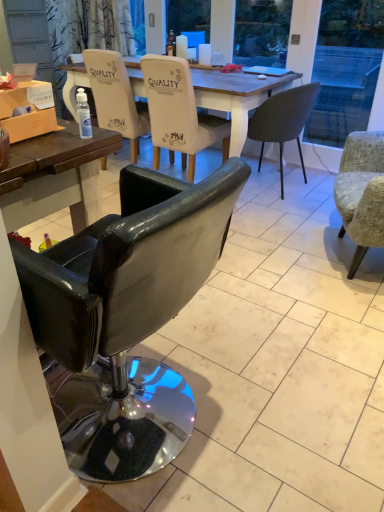
Question: In terms of width, does black leather chair at lower left, the fifth chair when ordered from back to front, look wider or thinner when compared to textured gray armchair at right, marked as the fourth chair in a back-to-front arrangement?

Choices:
 (A) wide
 (B) thin

Answer: (A)

Question: Would you say black leather chair at lower left, the fifth chair when ordered from back to front, is to the left or to the right of textured gray armchair at right, marked as the fourth chair in a back-to-front arrangement, in the picture?

Choices:
 (A) right
 (B) left

Answer: (B)

Question: Based on their relative distances, which object is farther from the matte white coffee cup at upper center, which is the 1th coffee cup from right to left?

Choices:
 (A) matte dark gray chair at center, which appears as the 2th chair when viewed from the back
 (B) white fabric chair at center, arranged as the third chair when viewed from the front
 (C) metallic silver laptop at center
 (D) matte white chair at center, placed as the 5th chair when sorted from front to back
 (E) matte white coffee cup at upper center, the first coffee cup positioned from the left

Answer: (D)

Question: Considering the real-world distances, which object is closest to the matte white chair at center, placed as the 5th chair when sorted from front to back?

Choices:
 (A) white fabric chair at center, arranged as the third chair when viewed from the back
 (B) metallic silver laptop at center
 (C) wooden box at left
 (D) matte white coffee cup at upper center, placed as the 2th coffee cup when sorted from left to right
 (E) black leather chair at lower left, acting as the 1th chair starting from the front

Answer: (A)